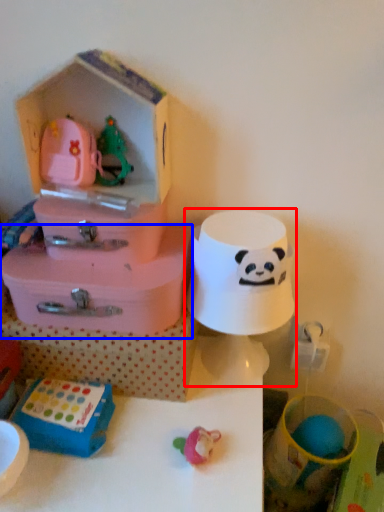
Question: Which point is closer to the camera, toy (highlighted by a red box) or storage box (highlighted by a blue box)?

Choices:
 (A) toy
 (B) storage box

Answer: (A)